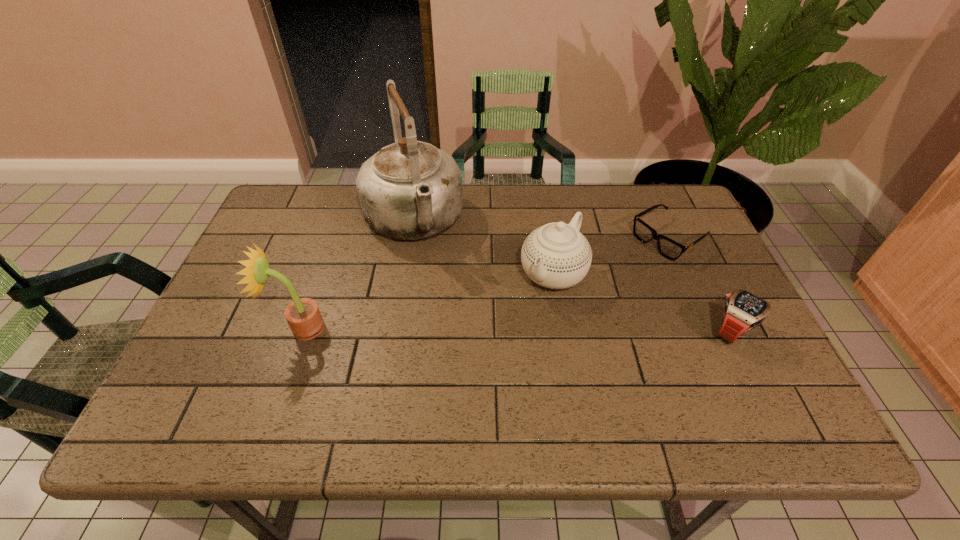
The width and height of the screenshot is (960, 540). In order to click on vacant space on the desktop that is between the sunflower and the second shortest object and is positioned on the spout of the third shortest object in this screenshot , I will do `click(508, 329)`.

Where is `free space on the desktop that is between the leftmost object and the watch and is positioned at the spout of the second object from left to right`? This screenshot has width=960, height=540. free space on the desktop that is between the leftmost object and the watch and is positioned at the spout of the second object from left to right is located at coordinates (455, 329).

Locate an element on the screen. vacant space on the desktop that is between the fourth shortest object and the second shortest object and is positioned on the front-facing side of the shortest object is located at coordinates (527, 329).